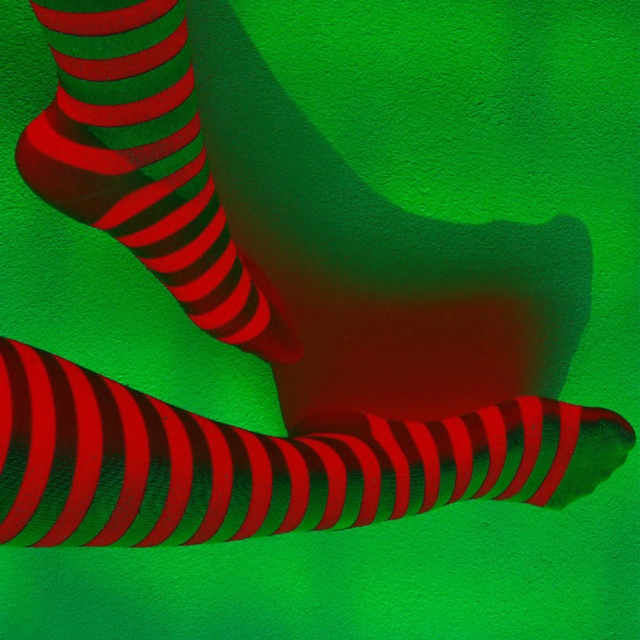
How far apart are shiny metallic sock at lower center and shiny metallic socks at upper left?

A distance of 31.14 centimeters exists between shiny metallic sock at lower center and shiny metallic socks at upper left.

Is shiny metallic sock at lower center above shiny metallic socks at upper left?

Incorrect, shiny metallic sock at lower center is not positioned above shiny metallic socks at upper left.

Does point (45, 356) lie in front of point (136, 108)?

Yes.

This screenshot has height=640, width=640. What are the coordinates of `shiny metallic sock at lower center` in the screenshot? It's located at (262, 461).